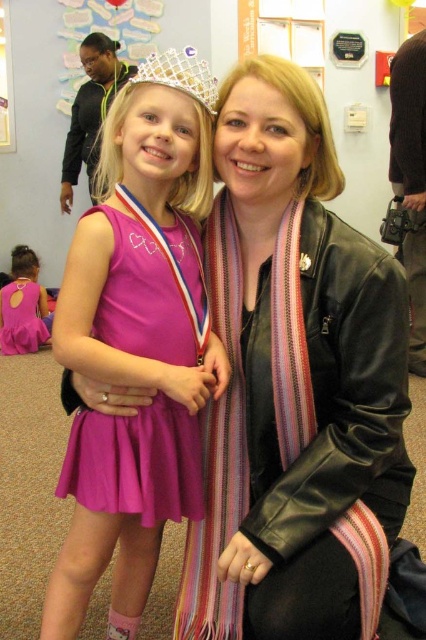
You are standing at point [163,54] and want to walk to point [141,259]. Is the destination point behind you or in front of you?

The destination point [141,259] is behind point [163,54], so it is behind you.

You are a photographer setting up for a group photo. You have to ensure that both the purple satin dress at center and the glittery plastic crown at upper center are clearly visible in the frame. Given their height difference, which object might require you to adjust your camera angle to avoid being obscured?

The glittery plastic crown at upper center might be obscured because the purple satin dress at center is taller and could block its view if not adjusted properly.

You are a photographer setting up for a group photo. You need to ensure that both the purple satin dress at center and the glittery plastic crown at upper center are clearly visible in the frame. Given their sizes, which object might require more careful positioning to avoid being obscured?

The glittery plastic crown at upper center requires more careful positioning because it is smaller in size compared to the purple satin dress at center, making it easier to be obscured if not placed thoughtfully.